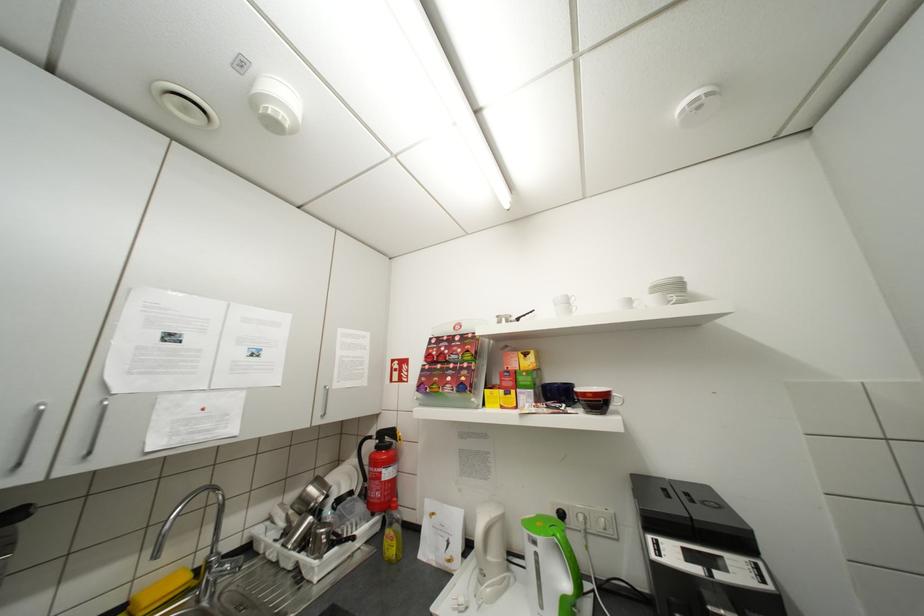
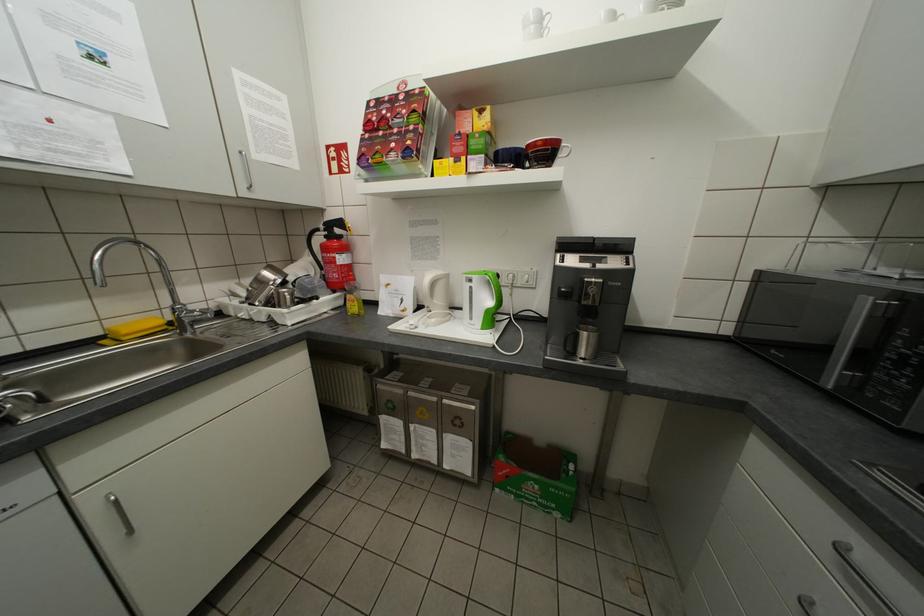
The point at [598,395] is marked in the first image. Where is the corresponding point in the second image?

(548, 144)